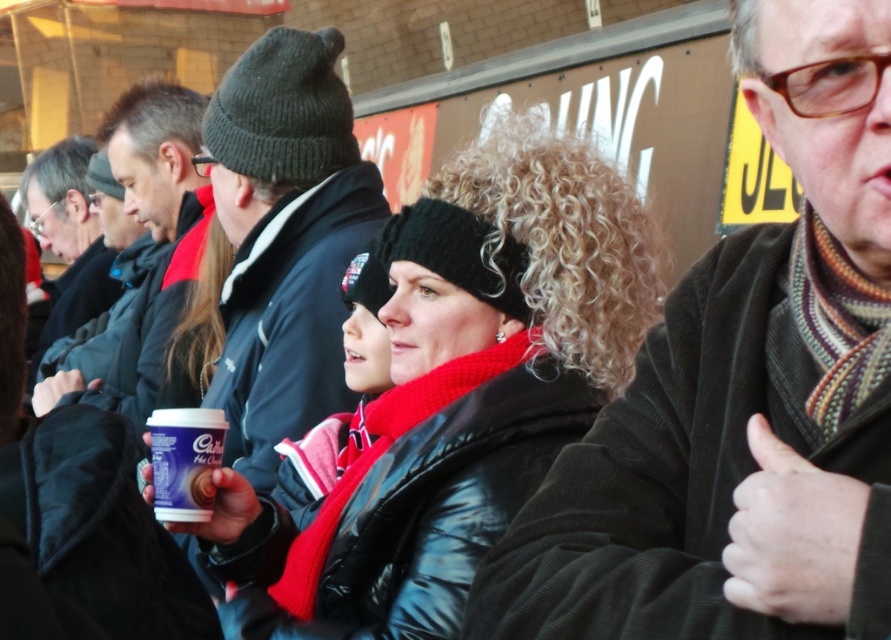
Question: In this image, where is knitted scarf at center located relative to purple matte cup at center?

Choices:
 (A) above
 (B) below

Answer: (B)

Question: Which point is closer to the camera?

Choices:
 (A) black matte jacket at center
 (B) knitted wool beanie at upper center
 (C) knitted scarf at center

Answer: (C)

Question: Which object is positioned closest to the knitted wool beanie at upper center?

Choices:
 (A) knitted scarf at center
 (B) purple matte cup at center
 (C) matte black jacket at center

Answer: (C)

Question: Where is knitted scarf at center located in relation to matte black jacket at center in the image?

Choices:
 (A) above
 (B) below

Answer: (B)

Question: Among these points, which one is farthest from the camera?

Choices:
 (A) (296, 428)
 (B) (178, 212)
 (C) (202, 504)

Answer: (B)

Question: Is matte black jacket at center smaller than purple matte cup at center?

Choices:
 (A) yes
 (B) no

Answer: (B)